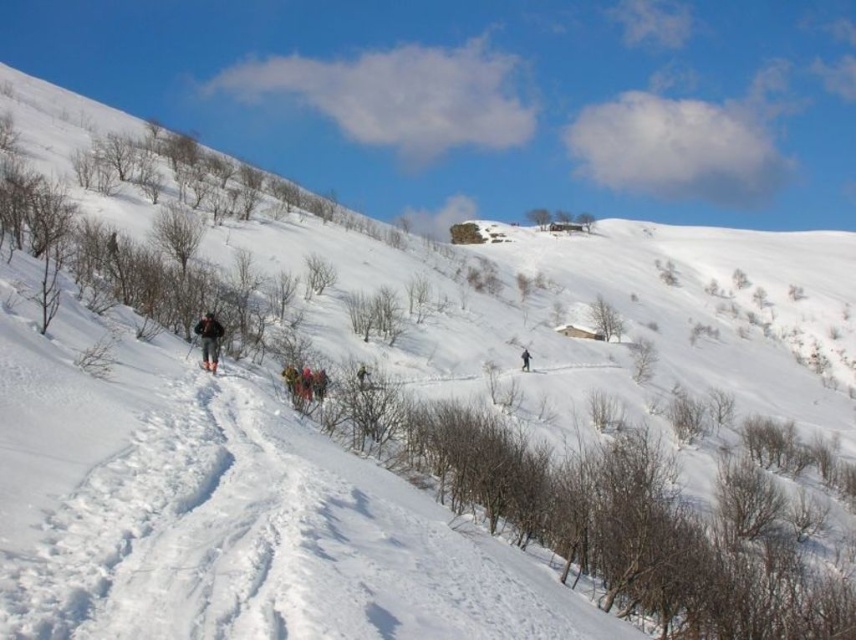
You are an observer standing at the top of the snow hill. You see a multicolored fabric group at center and a camouflage fabric jacket at center. Which object is wider?

The multicolored fabric group at center is wider than the camouflage fabric jacket at center.

Consider the image. You are an observer standing at the top of the snow hill. You see a multicolored fabric group at center and a green fabric jacket at center. Which one is closer to your right side?

The green fabric jacket at center is closer to your right side because the multicolored fabric group at center is to the left of it.